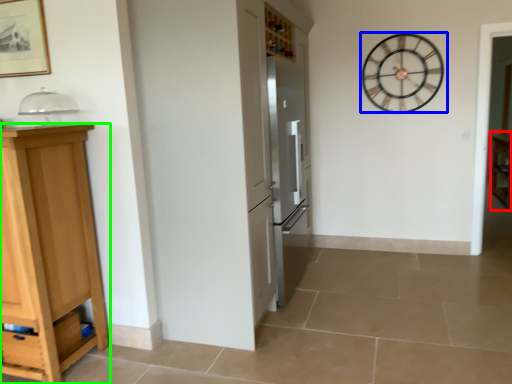
Question: Which object is positioned closest to cabinetry (highlighted by a red box)? Select from wall clock (highlighted by a blue box) and cabinetry (highlighted by a green box).

Choices:
 (A) wall clock
 (B) cabinetry

Answer: (A)